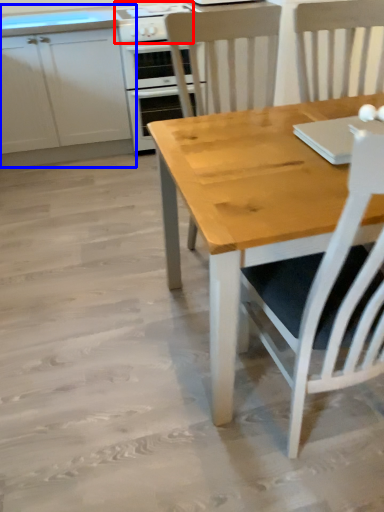
Question: Which object is closer to the camera taking this photo, gas stove (highlighted by a red box) or cabinetry (highlighted by a blue box)?

Choices:
 (A) gas stove
 (B) cabinetry

Answer: (B)